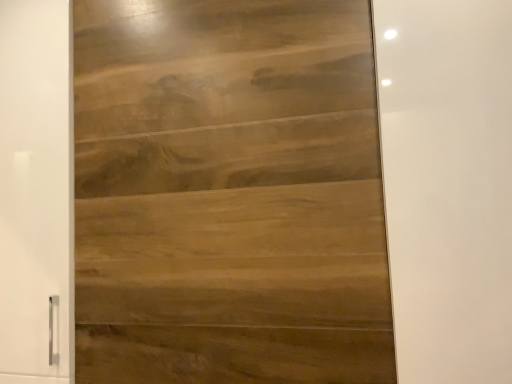
Question: From their relative heights in the image, would you say satin wood door at center is taller or shorter than wooden panel at left?

Choices:
 (A) tall
 (B) short

Answer: (B)

Question: In terms of size, does satin wood door at center appear bigger or smaller than wooden panel at left?

Choices:
 (A) big
 (B) small

Answer: (B)

Question: In the image, is satin wood door at center positioned in front of or behind wooden panel at left?

Choices:
 (A) behind
 (B) front

Answer: (B)

Question: Considering the positions of point (18, 104) and point (120, 107), is point (18, 104) closer or farther from the camera than point (120, 107)?

Choices:
 (A) farther
 (B) closer

Answer: (A)

Question: From a real-world perspective, relative to satin wood door at center, is wooden panel at left vertically above or below?

Choices:
 (A) above
 (B) below

Answer: (A)

Question: In terms of height, does wooden panel at left look taller or shorter compared to satin wood door at center?

Choices:
 (A) short
 (B) tall

Answer: (B)

Question: Is wooden panel at left wider or thinner than satin wood door at center?

Choices:
 (A) wide
 (B) thin

Answer: (A)